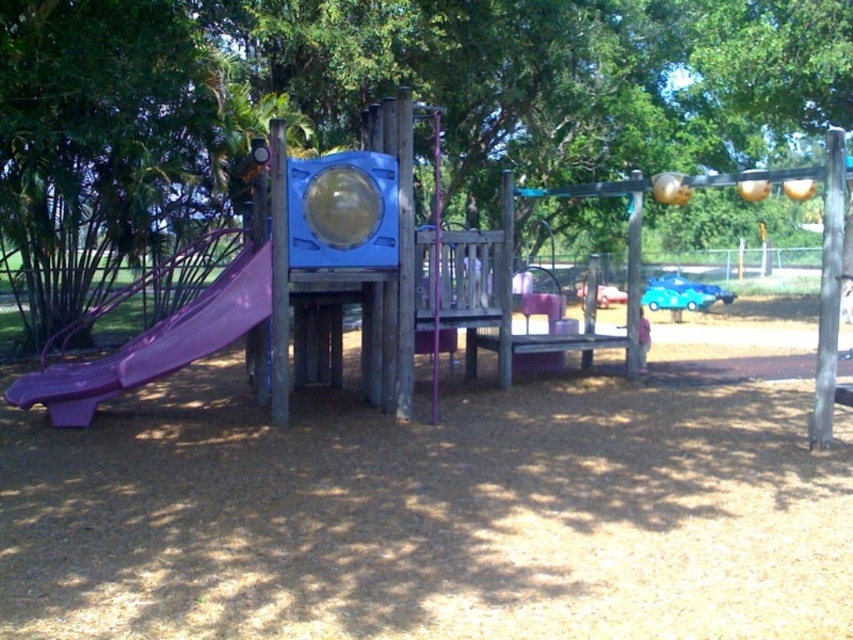
This screenshot has height=640, width=853. Describe the element at coordinates (393, 88) in the screenshot. I see `green leafy tree at upper center` at that location.

Who is higher up, green leafy tree at upper center or purple plastic slide at left?

Positioned higher is green leafy tree at upper center.

Does point (679, 33) come behind point (157, 348)?

That is True.

Locate an element on the screen. The width and height of the screenshot is (853, 640). green leafy tree at upper center is located at coordinates (393, 88).

Who is shorter, green leafy tree at upper center or pink plastic child at center?

With less height is pink plastic child at center.

Can you confirm if green leafy tree at upper center is positioned to the right of pink plastic child at center?

Correct, you'll find green leafy tree at upper center to the right of pink plastic child at center.

This screenshot has width=853, height=640. Describe the element at coordinates (393, 88) in the screenshot. I see `green leafy tree at upper center` at that location.

Identify the location of green leafy tree at upper center. (393, 88).

Who is positioned more to the right, purple plastic slide at left or pink plastic child at center?

From the viewer's perspective, pink plastic child at center appears more on the right side.

Is point (215, 285) farther from camera compared to point (648, 328)?

That is False.

Who is more forward, (193,304) or (642,344)?

Point (193,304) is in front.

This screenshot has height=640, width=853. Identify the location of purple plastic slide at left. (155, 344).